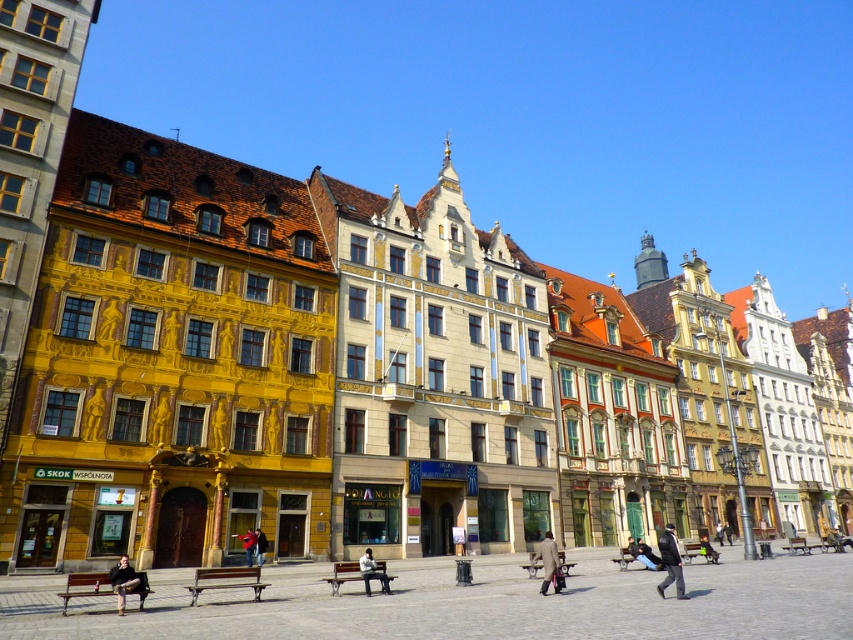
Who is taller, light brown leather coat at lower right or red leather jacket at center?

With more height is light brown leather coat at lower right.

Is light brown leather coat at lower right to the right of red leather jacket at center from the viewer's perspective?

Yes, light brown leather coat at lower right is to the right of red leather jacket at center.

Measure the distance between point [554,570] and camera.

108.96 feet

Identify the location of light brown leather coat at lower right. The width and height of the screenshot is (853, 640). (547, 561).

Is the position of light brown leather coat at lower right more distant than that of red jacket at center?

No, it is in front of red jacket at center.

The image size is (853, 640). What do you see at coordinates (547, 561) in the screenshot?
I see `light brown leather coat at lower right` at bounding box center [547, 561].

I want to click on light brown leather coat at lower right, so click(x=547, y=561).

Is dark blue jacket at center to the right of light brown wooden bench at center from the viewer's perspective?

Indeed, dark blue jacket at center is positioned on the right side of light brown wooden bench at center.

Is dark blue jacket at center wider than light brown wooden bench at center?

Yes, dark blue jacket at center is wider than light brown wooden bench at center.

You are a GUI agent. You are given a task and a screenshot of the screen. Output one action in this format:
    pyautogui.click(x=<x>, y=<y>)
    Task: Click on the dark blue jacket at center
    The width and height of the screenshot is (853, 640).
    Given the screenshot: What is the action you would take?
    pyautogui.click(x=670, y=563)

At what (x,y) coordinates should I click in order to perform the action: click on dark blue jacket at center. Please return your answer as a coordinate pair (x, y). The width and height of the screenshot is (853, 640). Looking at the image, I should click on (670, 563).